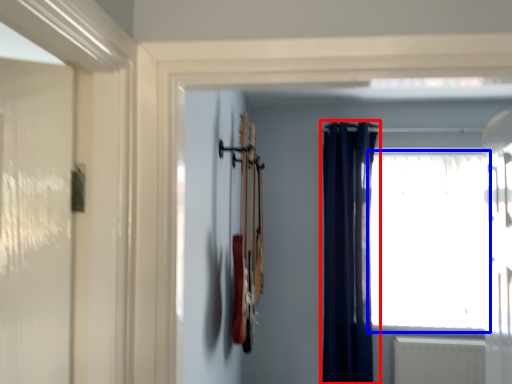
Question: Which point is closer to the camera, curtain (highlighted by a red box) or window (highlighted by a blue box)?

Choices:
 (A) curtain
 (B) window

Answer: (A)